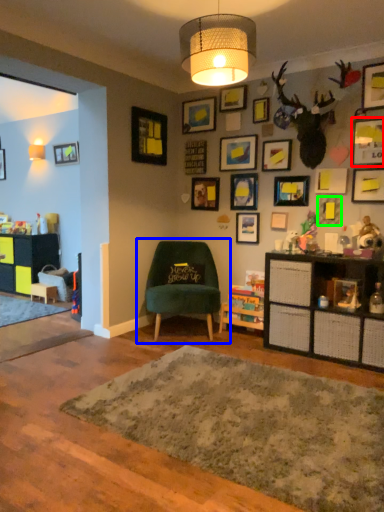
Question: Which is farther away from picture frame (highlighted by a red box)? chair (highlighted by a blue box) or picture frame (highlighted by a green box)?

Choices:
 (A) chair
 (B) picture frame

Answer: (A)